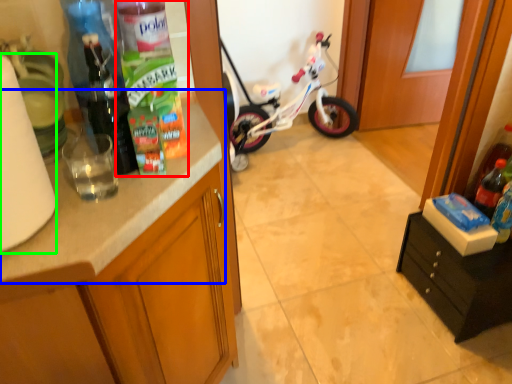
Question: Based on their relative distances, which object is farther from bottle (highlighted by a red box)? Choose from countertop (highlighted by a blue box) and paper towel (highlighted by a green box).

Choices:
 (A) countertop
 (B) paper towel

Answer: (B)